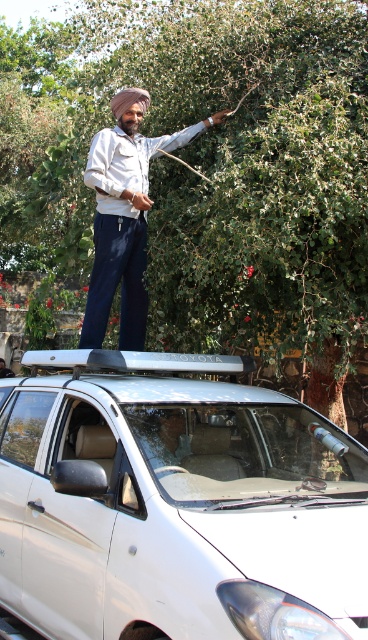
You are a drone operator trying to capture a photo of the green leafy tree at upper center. The camera is currently positioned at point 0.3, 0.6. To center the tree in the frame, should you move the camera slightly to the left or right?

The green leafy tree at upper center is at point (x=207, y=166). The camera is at (x=220, y=192). To center the tree, move the camera slightly to the left and down since the tree is to the left and below the current position.

You are a delivery driver who needs to park your car in a tight space between the white matte car at upper center and the matte white shirt at center. Can you safely park your car without hitting either object?

The white matte car at upper center is to the left of the matte white shirt at center. Since the car is positioned to the left, there might be enough space between them for parking, but without knowing the exact distance, it is risky to assume safety. Proceed with caution and measure the space first.